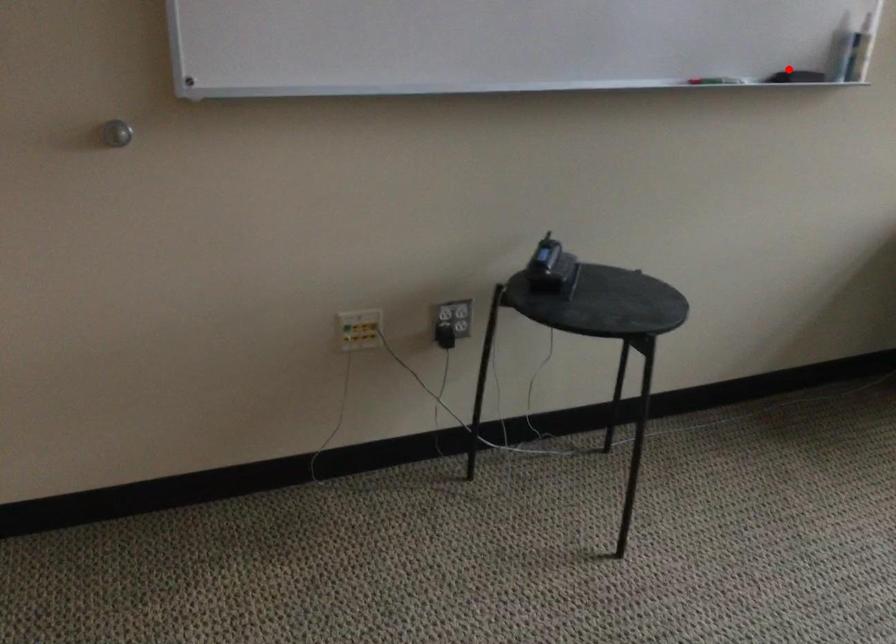
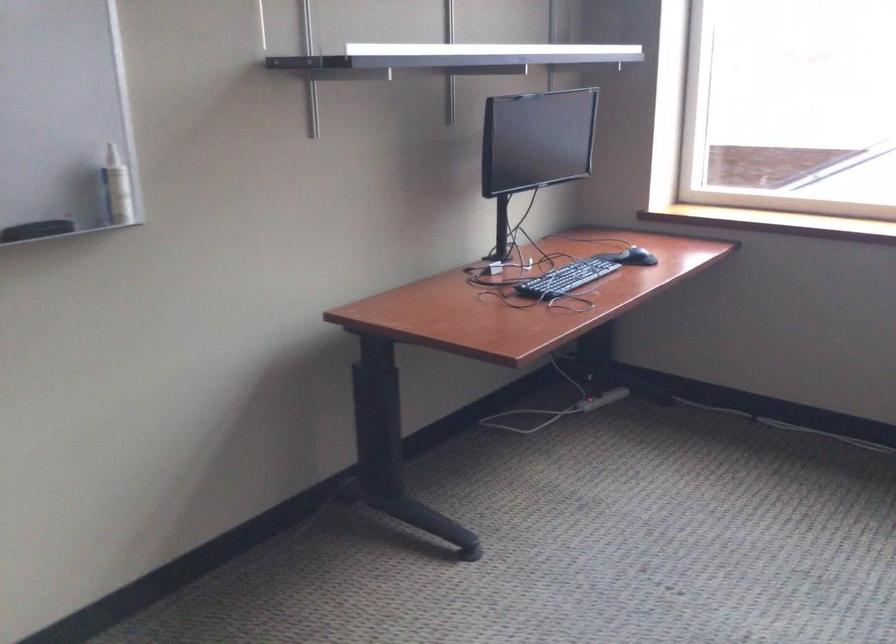
Question: I am providing you with two images of the same scene from different viewpoints. Given a red point in image1, look at the same physical point in image2. Is it:

Choices:
 (A) Closer to the viewpoint
 (B) Farther from the viewpoint

Answer: (A)